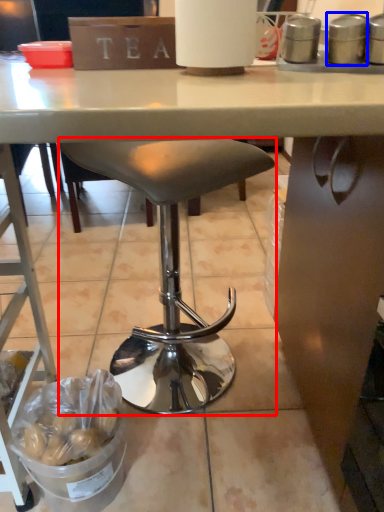
Question: Which point is further to the camera, stool (highlighted by a red box) or appliance (highlighted by a blue box)?

Choices:
 (A) stool
 (B) appliance

Answer: (A)